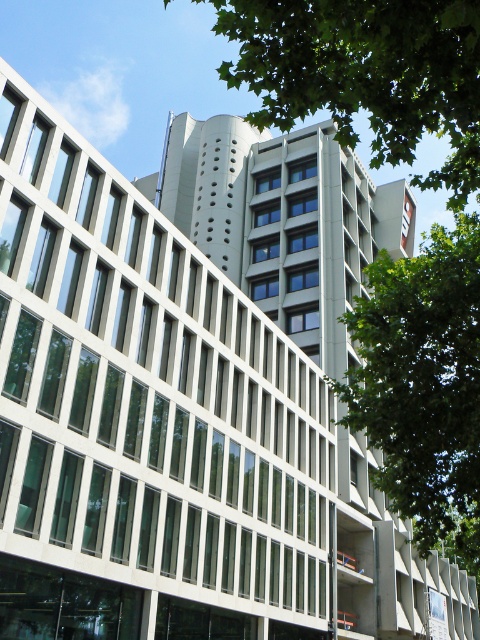
You are standing in front of the modern architectural structure and notice a green leafy tree at upper center. Based on its coordinates, can you determine its position relative to the building?

The green leafy tree at upper center is located at point coordinates approximately 0.116 on the x and 0.762 on the y axis, meaning it is positioned towards the upper left quadrant of the image relative to the building.

Looking at this image, you are an architect analyzing the building design. You notice two green leafy trees in the image. Which tree, the green leafy tree at upper center or the green leafy tree at right, would cast a bigger shadow given the same sunlight conditions?

The green leafy tree at upper center is larger in size than the green leafy tree at right, so it would cast a bigger shadow.

You are an urban planner assessing the building layout. You notice the green leafy tree at upper center and the green leafy tree at right. Which tree would cast a longer shadow during midday, assuming the sun is directly overhead?

The green leafy tree at upper center is taller than the green leafy tree at right, so it would cast a longer shadow during midday when the sun is overhead.